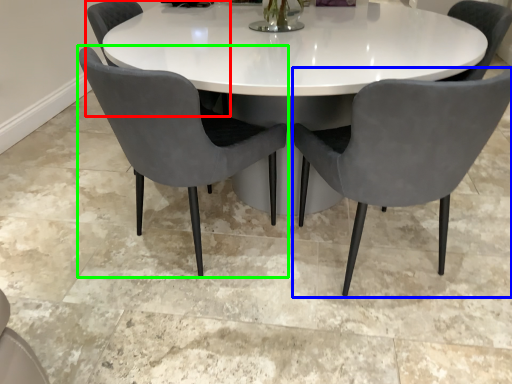
Question: Based on their relative distances, which object is farther from chair (highlighted by a red box)? Choose from chair (highlighted by a blue box) and chair (highlighted by a green box).

Choices:
 (A) chair
 (B) chair

Answer: (A)